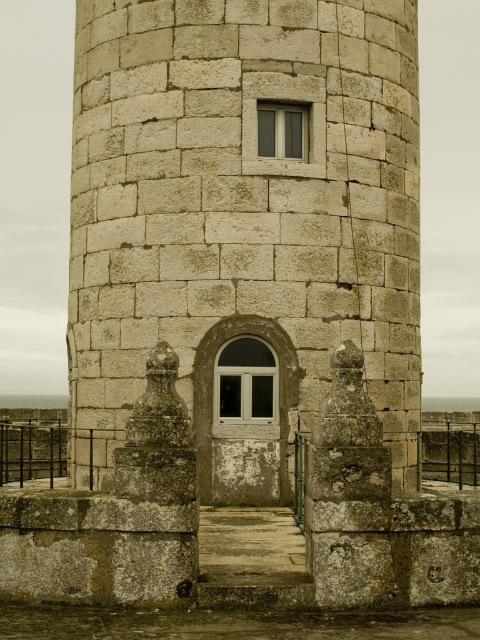
You are standing in front of a stone structure and want to take a photo of the stone textured tower at center. If your camera can focus on objects up to 15 meters away, will it be able to capture the tower clearly?

The stone textured tower at center is 13.51 meters from viewer, so yes, the camera can focus on it clearly since it is within the 15 meters range.

You are an architect examining the stone textured tower at center and the matte glass window at upper center in the image. Which object is positioned to the right side of the other?

The stone textured tower at center is to the left of matte glass window at upper center, so the matte glass window at upper center is positioned to the right side of the stone textured tower at center.

You are standing in front of the cylindrical stone structure and notice two windows. The first is the white glass window at center, and the second is the matte glass window at upper center. Which window is positioned to the right when viewed from the front?

The matte glass window at upper center is positioned to the right of the white glass window at center.